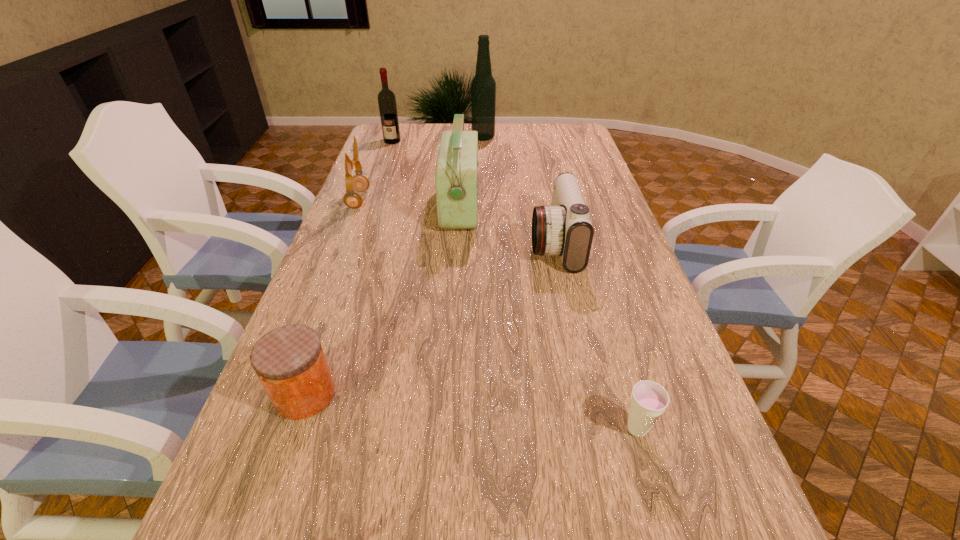
Find the location of a particular element. camcorder present at the right edge is located at coordinates (564, 228).

Image resolution: width=960 pixels, height=540 pixels. Find the location of `cup present at the right edge`. cup present at the right edge is located at coordinates (649, 399).

The image size is (960, 540). I want to click on object located at the far left corner, so 386,98.

This screenshot has height=540, width=960. What are the coordinates of `free region at the far edge of the desktop` in the screenshot? It's located at (421, 130).

Find the location of `free location at the left edge`. free location at the left edge is located at coordinates (395, 183).

I want to click on free space at the right edge of the desktop, so click(686, 447).

Find the location of `free spot between the jar and the left alcohol`. free spot between the jar and the left alcohol is located at coordinates (348, 268).

Locate an element on the screen. Image resolution: width=960 pixels, height=540 pixels. unoccupied position between the sixth tallest object and the shorter alcohol is located at coordinates (348, 268).

Locate an element on the screen. unoccupied position between the earphone and the jar is located at coordinates (331, 297).

Locate an element on the screen. This screenshot has height=540, width=960. vacant area that lies between the earphone and the tallest object is located at coordinates coord(420,168).